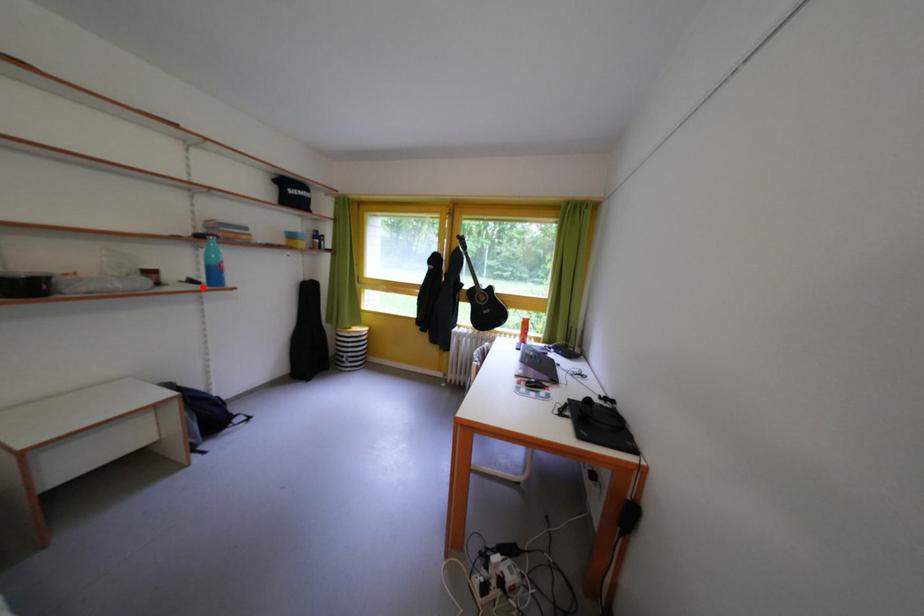
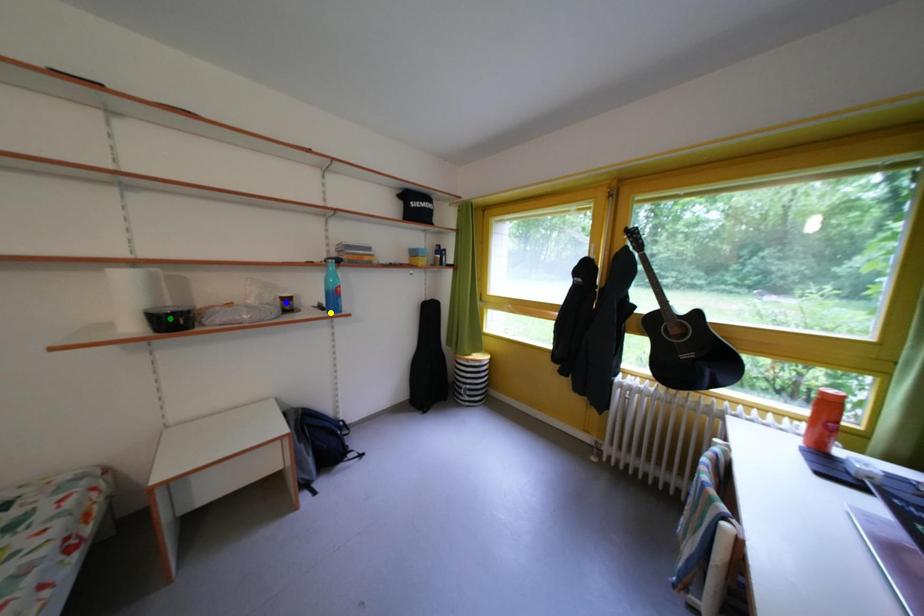
Question: I am providing you with two images of the same scene from different viewpoints. A red point is marked on the first image. You are given multiple points on the second image. Which point in image 2 is actually the same real-world point as the red point in image 1?

Choices:
 (A) yellow point
 (B) blue point
 (C) green point

Answer: (A)